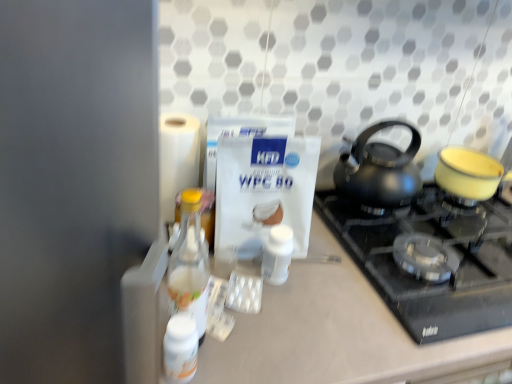
At what (x,y) coordinates should I click in order to perform the action: click on free space to the right of white matte bottle at center, the first bottle when ordered from back to front. Please return your answer as a coordinate pair (x, y). This screenshot has height=384, width=512. Looking at the image, I should click on (347, 291).